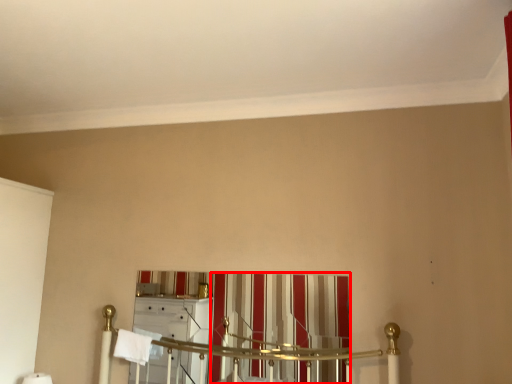
Question: From the image's perspective, where is curtain (annotated by the red box) located in relation to bath towel in the image?

Choices:
 (A) below
 (B) above

Answer: (B)